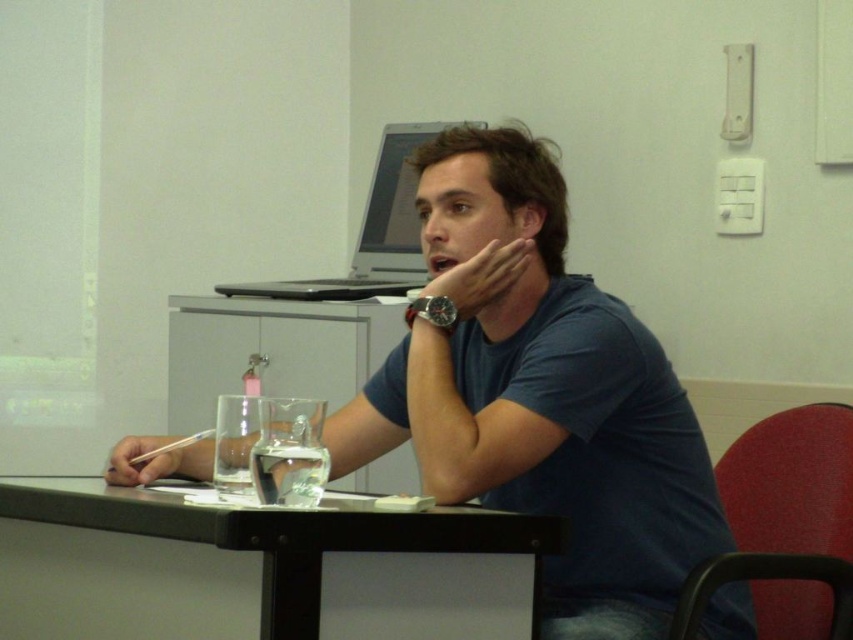
You are organizing a presentation and need to place the silver metallic laptop at upper center and the matte black watch at center on a shelf. The shelf has a maximum weight capacity of 5 kilograms. Knowing that the watch weighs 100 grams, can you determine if both items can be safely placed together on the shelf?

The silver metallic laptop at upper center has a larger size compared to matte black watch at center. However, the weight of the laptop is not provided. Since the watch alone weighs only 100 grams, which is well under the 5 kg limit, but without knowing the laptop weight, we cannot confirm if their combined weight exceeds the limit. Therefore, it is uncertain if both can be safely placed together.

You are a student who needs to check the time on your watch. You see the matte black watch at center and the matte skin jaw at center. Which object is larger and therefore easier to read?

The matte black watch at center is bigger than matte skin jaw at center, so it is easier to read.

You are a person who needs to reach both the silver metallic laptop at upper center and the matte black watch at center on the table. If you can only move one of them, which one should you move to make space for a new item that requires 12 inches of space?

Since the silver metallic laptop at upper center and the matte black watch at center are 36.19 inches apart, moving the matte black watch at center would be more practical to create space because it is smaller and closer to the area needing expansion.